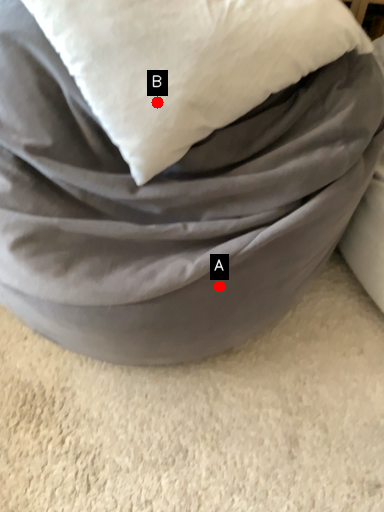
Question: Two points are circled on the image, labeled by A and B beside each circle. Which of the following is the farthest from the observer?

Choices:
 (A) A is further
 (B) B is further

Answer: (A)